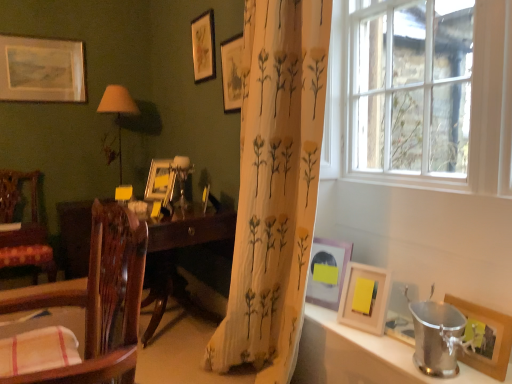
Question: Would you say wooden chair at left, the 1th chair from the front, is a long distance from matte gold picture frame at center, which is the 2th picture frame in back-to-front order?

Choices:
 (A) no
 (B) yes

Answer: (B)

Question: Could you tell me if wooden chair at left, acting as the 2th chair starting from the left, is turned towards matte gold picture frame at center, which is the 2th picture frame in back-to-front order?

Choices:
 (A) no
 (B) yes

Answer: (A)

Question: Considering the relative sizes of wooden chair at left, acting as the 2th chair starting from the left, and matte gold picture frame at center, which is the 2th picture frame in back-to-front order, in the image provided, is wooden chair at left, acting as the 2th chair starting from the left, smaller than matte gold picture frame at center, which is the 2th picture frame in back-to-front order,?

Choices:
 (A) yes
 (B) no

Answer: (B)

Question: From a real-world perspective, is wooden chair at left, acting as the 2th chair starting from the left, physically above matte gold picture frame at center, arranged as the 6th picture frame when viewed from the right?

Choices:
 (A) yes
 (B) no

Answer: (B)

Question: Is wooden chair at left, acting as the 2th chair starting from the left, thinner than matte gold picture frame at center, which is the 2th picture frame in back-to-front order?

Choices:
 (A) no
 (B) yes

Answer: (A)

Question: Could matte gold picture frame at center, marked as the 6th picture frame in a front-to-back arrangement, be considered to be inside wooden chair at left, the 1th chair from the front?

Choices:
 (A) no
 (B) yes

Answer: (A)

Question: From a real-world perspective, is matte wooden picture frame at upper center, arranged as the fourth picture frame when viewed from the front, located beneath silver metallic bucket at lower right?

Choices:
 (A) yes
 (B) no

Answer: (B)

Question: Is matte wooden picture frame at upper center, the fourth picture frame viewed from the left, to the left of silver metallic bucket at lower right from the viewer's perspective?

Choices:
 (A) yes
 (B) no

Answer: (A)

Question: Can you confirm if matte wooden picture frame at upper center, which appears as the fourth picture frame when viewed from the right, is taller than silver metallic bucket at lower right?

Choices:
 (A) yes
 (B) no

Answer: (B)

Question: Does matte wooden picture frame at upper center, the fourth picture frame positioned from the back, appear on the right side of silver metallic bucket at lower right?

Choices:
 (A) yes
 (B) no

Answer: (B)

Question: From a real-world perspective, is matte wooden picture frame at upper center, the fourth picture frame viewed from the left, physically above silver metallic bucket at lower right?

Choices:
 (A) no
 (B) yes

Answer: (B)

Question: From the image's perspective, would you say matte wooden picture frame at upper center, arranged as the fourth picture frame when viewed from the front, is positioned over silver metallic bucket at lower right?

Choices:
 (A) yes
 (B) no

Answer: (A)

Question: Is wooden chair at left, arranged as the first chair when viewed from the right, closer to the viewer compared to matte brown lampshade at left?

Choices:
 (A) yes
 (B) no

Answer: (A)